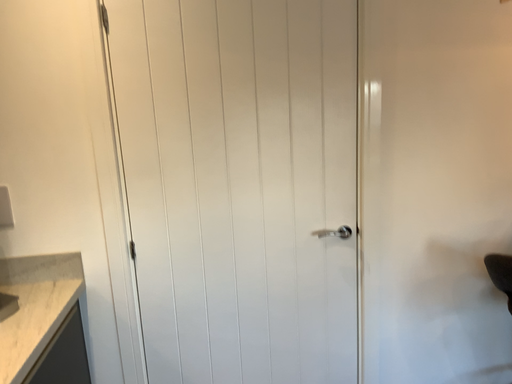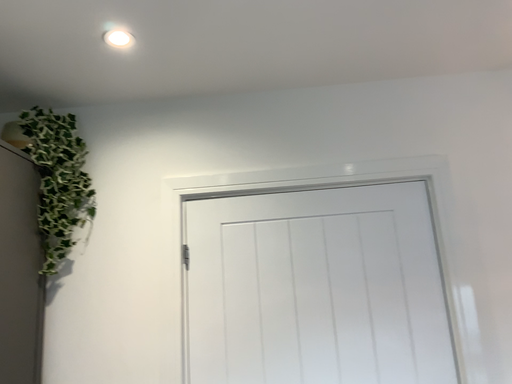
Question: How did the camera likely rotate when shooting the video?

Choices:
 (A) rotated upward
 (B) rotated downward

Answer: (A)